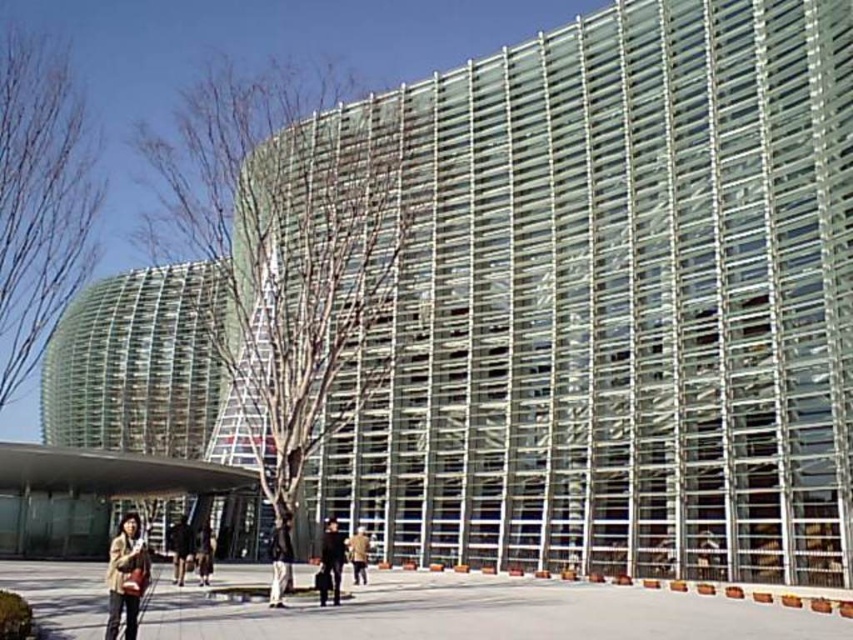
You are standing in front of the modern building and see the bare branches at left and the matte brown jacket at lower left. Which object is positioned more to the left side of the scene?

The bare branches at left are positioned more to the left side of the scene compared to the matte brown jacket at lower left.

You are standing in front of the modern architectural building and want to walk from the point closer to you to the point further away. Which path should you take between the two points, point (78, 200) and point (144, 582)?

You should walk from point (78, 200) to point (144, 582) because point (78, 200) is closer to you and point (144, 582) is further away.

You are standing in front of the modern glass building and notice two points marked in the scene. The first point is at coordinates point (277, 540) and the second is at point (354, 550). Which of these two points is closer to your current position?

Point (277, 540) is closer to the camera than point (354, 550).